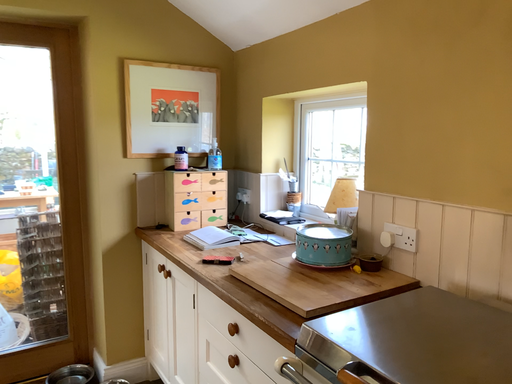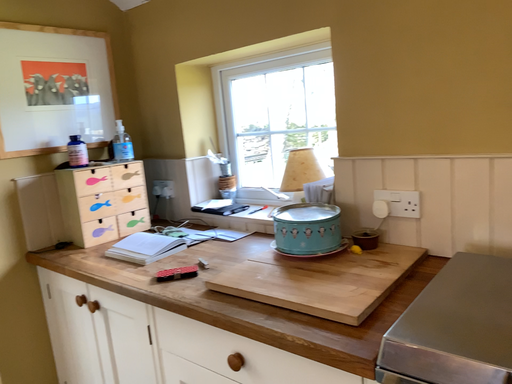
Question: How did the camera likely rotate when shooting the video?

Choices:
 (A) rotated left
 (B) rotated right

Answer: (B)